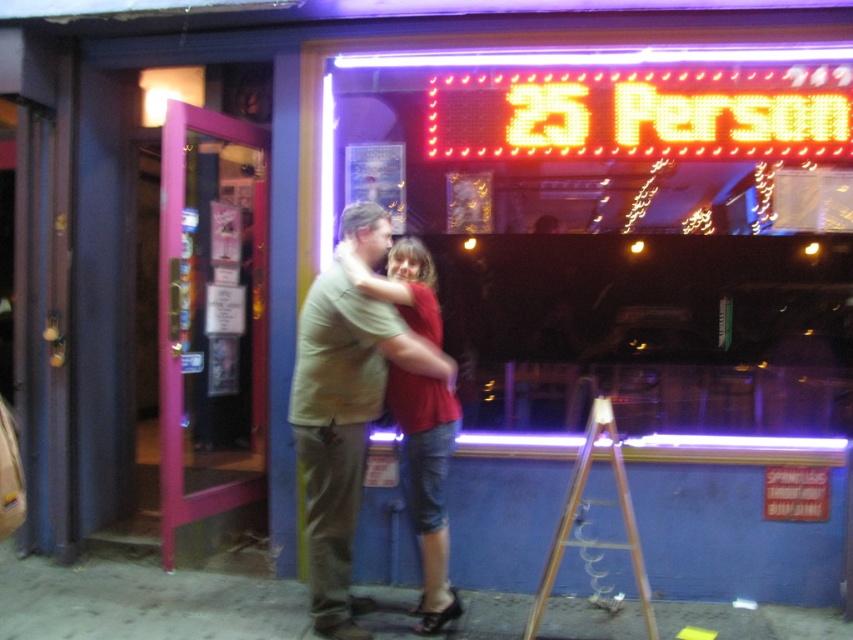
Question: Which of the following is the closest to the observer?

Choices:
 (A) orange led sign at upper center
 (B) wooden at center
 (C) beige cotton shirt at center
 (D) matte red shirt at center

Answer: (B)

Question: Which point appears closest to the camera in this image?

Choices:
 (A) (709, 104)
 (B) (561, 540)
 (C) (338, 419)

Answer: (C)

Question: Which object appears closest to the camera in this image?

Choices:
 (A) matte red shirt at center
 (B) wooden at center
 (C) beige cotton shirt at center
 (D) orange led sign at upper center

Answer: (B)

Question: Can you confirm if orange led sign at upper center is positioned to the left of wooden at center?

Choices:
 (A) yes
 (B) no

Answer: (B)

Question: Can you confirm if orange led sign at upper center is bigger than wooden at center?

Choices:
 (A) yes
 (B) no

Answer: (B)

Question: Observing the image, what is the correct spatial positioning of beige cotton shirt at center in reference to wooden at center?

Choices:
 (A) right
 (B) left

Answer: (B)